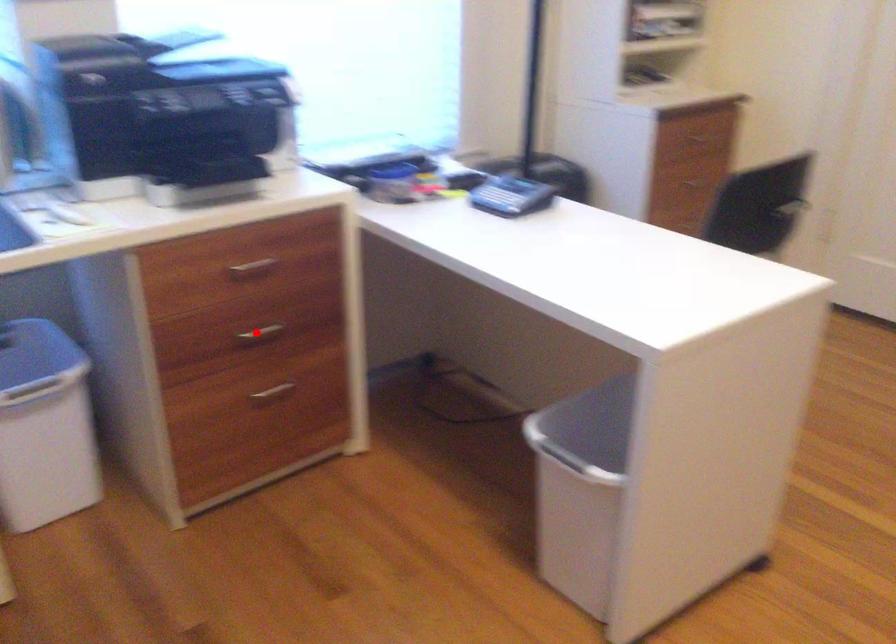
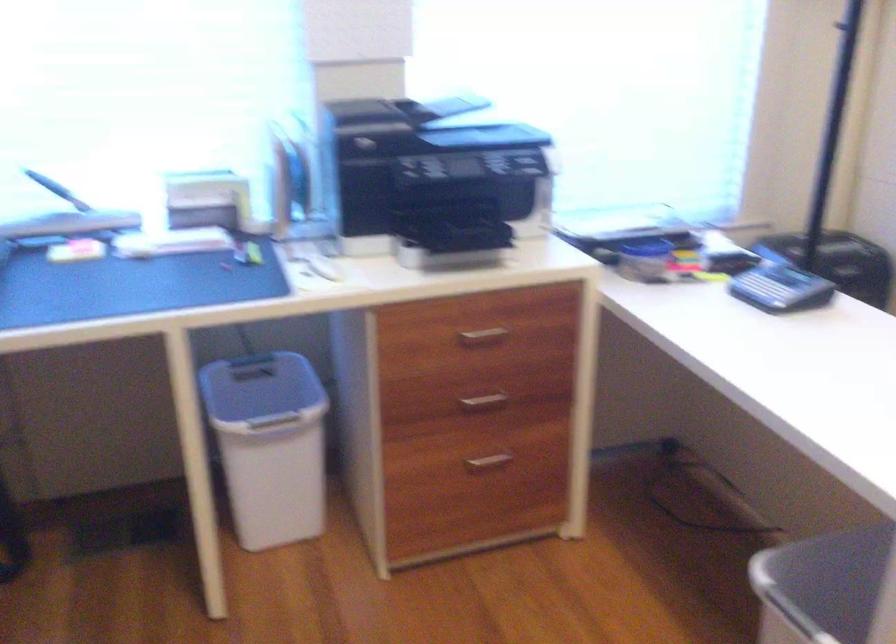
Find the pixel in the second image that matches the highlighted location in the first image.

(484, 401)